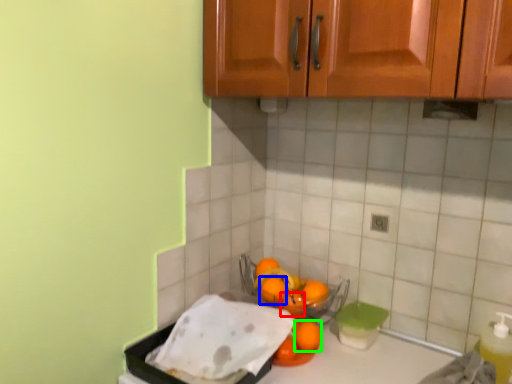
Question: Which object is the closest to the orange (highlighted by a red box)? Choose among these: orange (highlighted by a blue box) or orange (highlighted by a green box).

Choices:
 (A) orange
 (B) orange

Answer: (A)